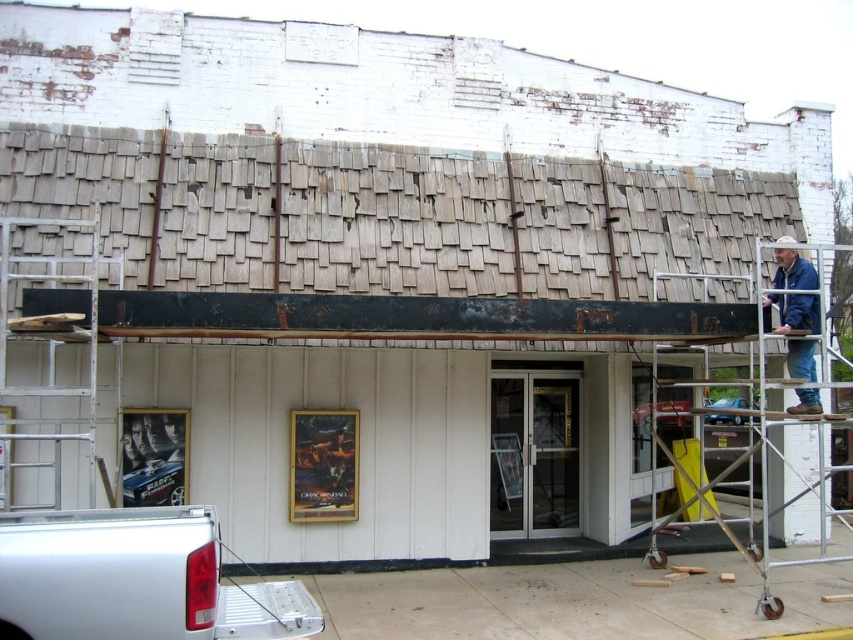
You are a construction worker standing at the entrance of the building. You need to retrieve your blue denim jacket at upper right that is hanging on the metal scaffolding at right. Which side of the scaffolding should you look on to find your jacket?

The blue denim jacket at upper right is positioned on the left side of the metal scaffolding at right, so you should look on the left side of the scaffolding to find your jacket.

You are a painter who needs to reach the highest point of the building facade. You have access to both the silver metallic ladder at left and the metal scaffolding at right. Which one should you use to reach the highest point?

The silver metallic ladder at left has a greater height compared to the metal scaffolding at right, so you should use the silver metallic ladder at left to reach the highest point.

You are a delivery person with a package that needs to be placed between the silver metallic ladder at left and the metal scaffolding at right. The package requires a space of 25 feet to be safely placed. Can you fit the package between them?

The distance between the silver metallic ladder at left and the metal scaffolding at right is 24.32 feet, which is less than the required 25 feet. Therefore, the package cannot be safely placed between them.